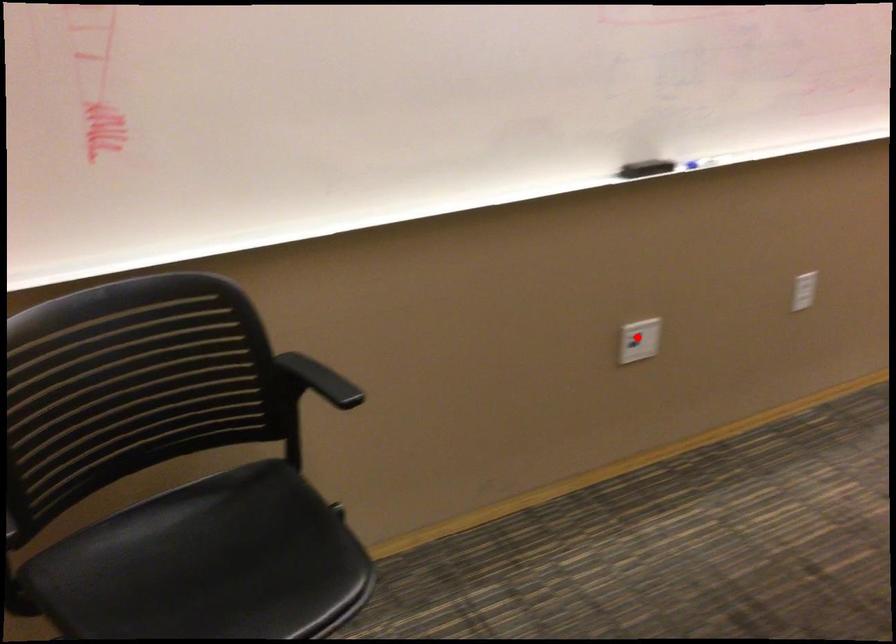
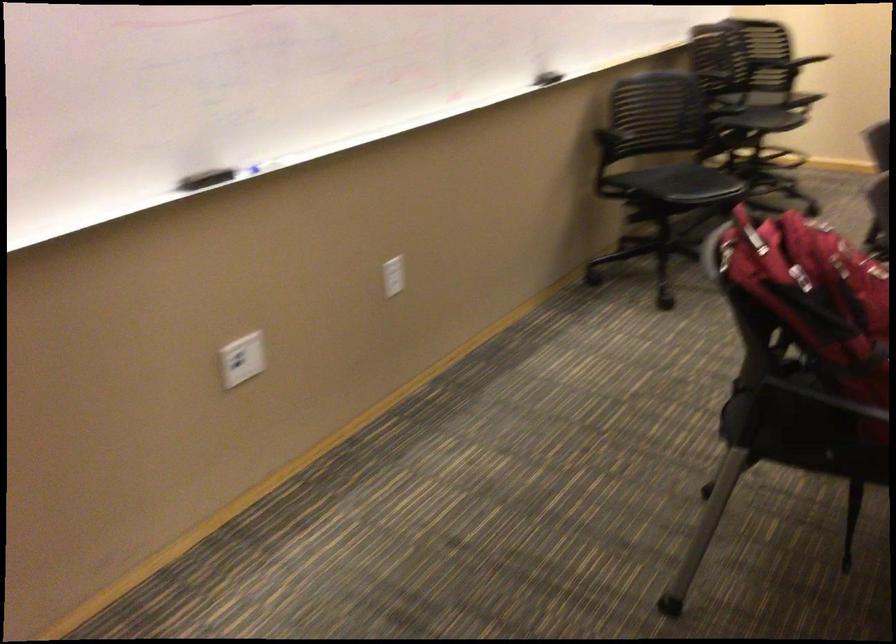
Find the pixel in the second image that matches the highlighted location in the first image.

(242, 359)